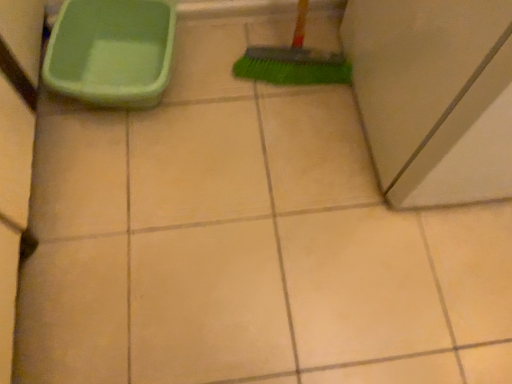
I want to click on free location in front of matte gray cabinet at right, so click(x=386, y=276).